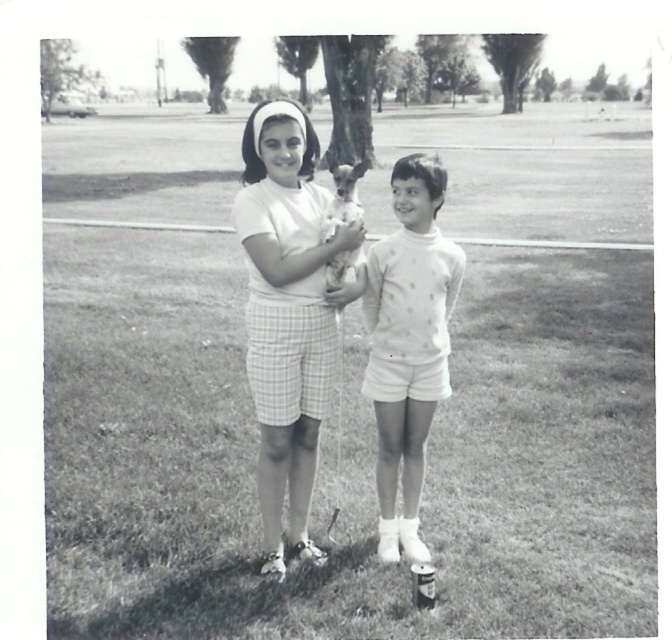
You are a photographer analyzing the composition of this image. The white plaid shorts at center are positioned at coordinates. Where exactly are they located in terms of the image frame?

The white plaid shorts at center are located at the coordinates point (288, 316) in the image frame.

You are a photographer who wants to capture a photo of both the white plaid shorts at center and the white dotted sweater at center in the same frame. Based on their positions, which one should you focus on first to ensure both are in the frame?

The white plaid shorts at center is positioned on the left side of white dotted sweater at center, so you should focus on the white plaid shorts at center first to ensure both are in the frame.